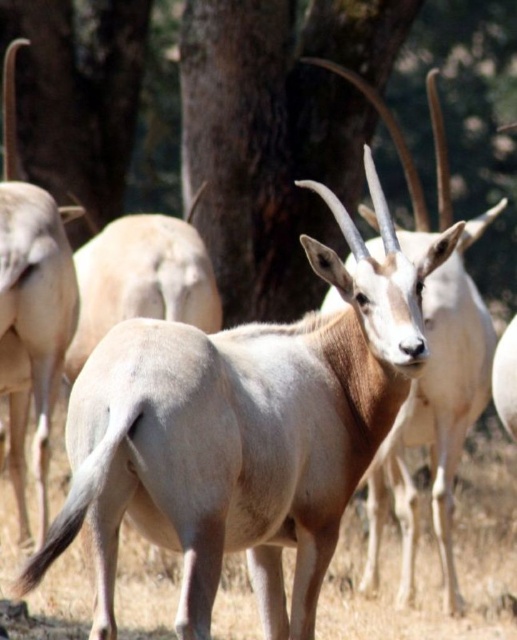
The height and width of the screenshot is (640, 517). Find the location of `brown rough tree at center`. brown rough tree at center is located at coordinates (264, 150).

Does point (292, 115) come behind point (116, 177)?

No, (292, 115) is closer to viewer.

Describe the element at coordinates (264, 150) in the screenshot. Image resolution: width=517 pixels, height=640 pixels. I see `brown rough tree at center` at that location.

Locate an element on the screen. This screenshot has height=640, width=517. brown rough tree at center is located at coordinates (264, 150).

Does light brown fur antelope at center have a larger size compared to brown rough tree trunk at upper center?

Yes.

Where is `light brown fur antelope at center`? The image size is (517, 640). light brown fur antelope at center is located at coordinates (435, 419).

Is brown rough tree at center bigger than light brown fur antelope at center?

No.

This screenshot has height=640, width=517. What do you see at coordinates (264, 150) in the screenshot?
I see `brown rough tree at center` at bounding box center [264, 150].

Locate an element on the screen. This screenshot has height=640, width=517. brown rough tree at center is located at coordinates (264, 150).